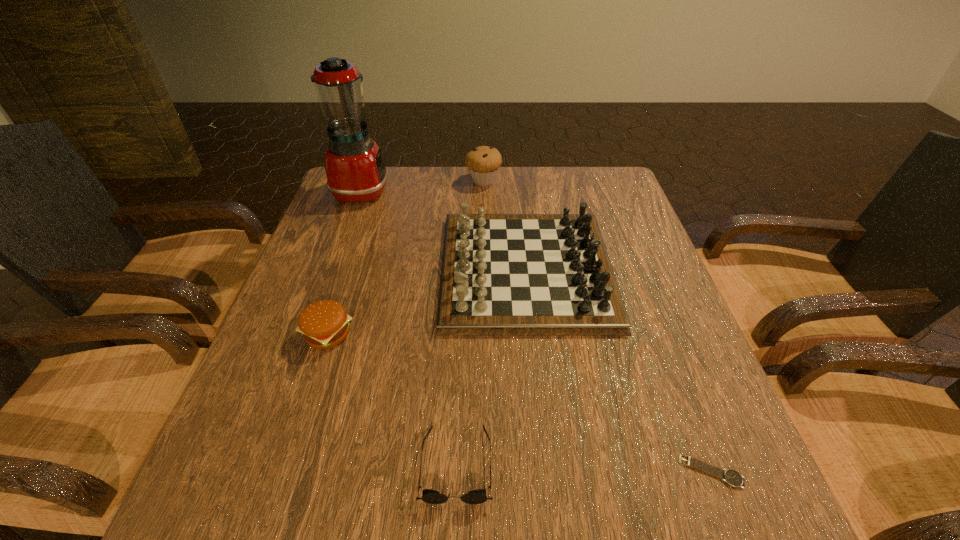
Locate an element on the screen. The width and height of the screenshot is (960, 540). free space between the shortest object and the chessboard is located at coordinates (618, 370).

Locate an element on the screen. empty space that is in between the fourth tallest object and the sunglasses is located at coordinates (392, 399).

You are a GUI agent. You are given a task and a screenshot of the screen. Output one action in this format:
    pyautogui.click(x=<x>, y=<y>)
    Task: Click on the blank region between the rightmost object and the hamburger
    Image resolution: width=960 pixels, height=540 pixels.
    Given the screenshot: What is the action you would take?
    pyautogui.click(x=519, y=403)

Locate an element on the screen. The image size is (960, 540). free spot between the muffin and the third shortest object is located at coordinates (405, 257).

Identify which object is located as the fifth nearest to the muffin. Please provide its 2D coordinates. Your answer should be formatted as a tuple, i.e. [(x, y)], where the tuple contains the x and y coordinates of a point satisfying the conditions above.

[(730, 476)]

Find the location of a particular element. Image resolution: width=960 pixels, height=540 pixels. object that stands as the fifth closest to the hamburger is located at coordinates tap(730, 476).

Where is `free space that satisfies the following two spatial constraints: 1. on the controls of the rightmost object; 2. on the left side of the tallest object`? Image resolution: width=960 pixels, height=540 pixels. free space that satisfies the following two spatial constraints: 1. on the controls of the rightmost object; 2. on the left side of the tallest object is located at coordinates (259, 471).

The image size is (960, 540). Find the location of `vacant position in the image that satisfies the following two spatial constraints: 1. on the controls of the hamburger; 2. on the left side of the tallest object`. vacant position in the image that satisfies the following two spatial constraints: 1. on the controls of the hamburger; 2. on the left side of the tallest object is located at coordinates (309, 334).

Locate an element on the screen. The width and height of the screenshot is (960, 540). free space that satisfies the following two spatial constraints: 1. on the front-facing side of the sunglasses; 2. on the left side of the shortest object is located at coordinates (456, 471).

At what (x,y) coordinates should I click in order to perform the action: click on vacant space that satisfies the following two spatial constraints: 1. on the back side of the muffin; 2. on the right side of the hamburger. Please return your answer as a coordinate pair (x, y). This screenshot has width=960, height=540. Looking at the image, I should click on (377, 180).